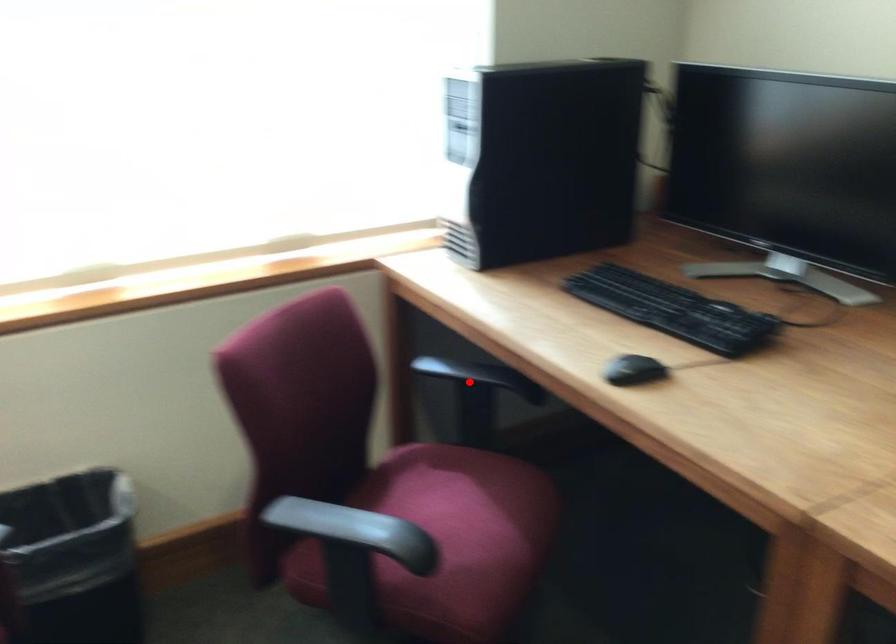
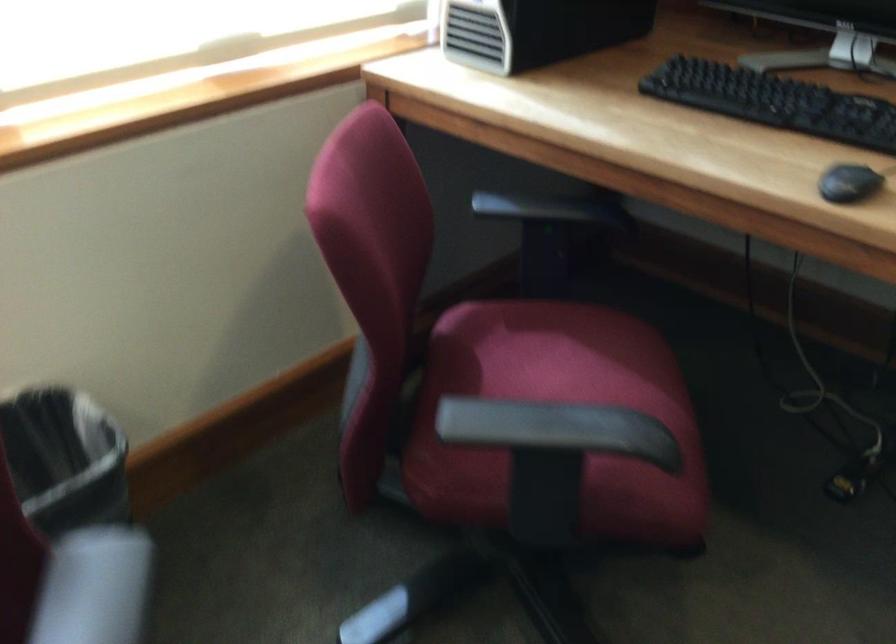
Question: I am providing you with two images of the same scene from different viewpoints. A red point is shown in image1. For the corresponding object point in image2, is it positioned nearer or farther from the camera?

Choices:
 (A) Nearer
 (B) Farther

Answer: (A)